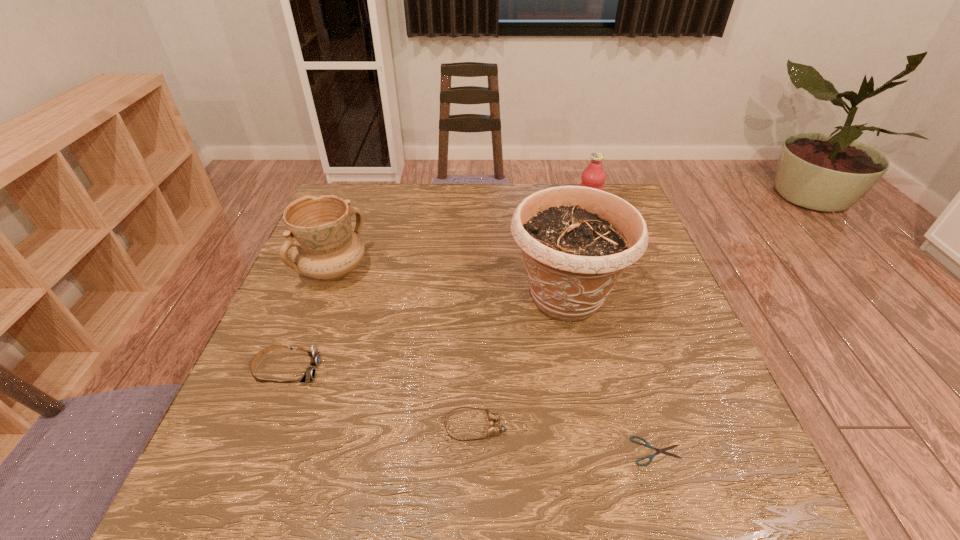
The image size is (960, 540). In order to click on flowerpot in this screenshot , I will do `click(576, 241)`.

Find the location of a particular element. The width and height of the screenshot is (960, 540). the farthest object is located at coordinates (594, 176).

The image size is (960, 540). In order to click on pottery in this screenshot , I will do `click(319, 229)`.

Identify the location of the taller goggles. (310, 373).

You are a GUI agent. You are given a task and a screenshot of the screen. Output one action in this format:
    pyautogui.click(x=<x>, y=<y>)
    Task: Click on the left goggles
    The width and height of the screenshot is (960, 540).
    Given the screenshot: What is the action you would take?
    pyautogui.click(x=310, y=373)

Where is `the second shortest object`? the second shortest object is located at coordinates (493, 429).

Image resolution: width=960 pixels, height=540 pixels. What are the coordinates of `the shorter goggles` in the screenshot? It's located at (493, 429).

You are a GUI agent. You are given a task and a screenshot of the screen. Output one action in this format:
    pyautogui.click(x=<x>, y=<y>)
    Task: Click on the shortest object
    
    Given the screenshot: What is the action you would take?
    pyautogui.click(x=647, y=444)

This screenshot has width=960, height=540. Find the location of `free spot located on the back of the flowerpot`. free spot located on the back of the flowerpot is located at coordinates (545, 194).

This screenshot has height=540, width=960. Find the location of `free spot located 0.330m on the label of the farthest object`. free spot located 0.330m on the label of the farthest object is located at coordinates (465, 218).